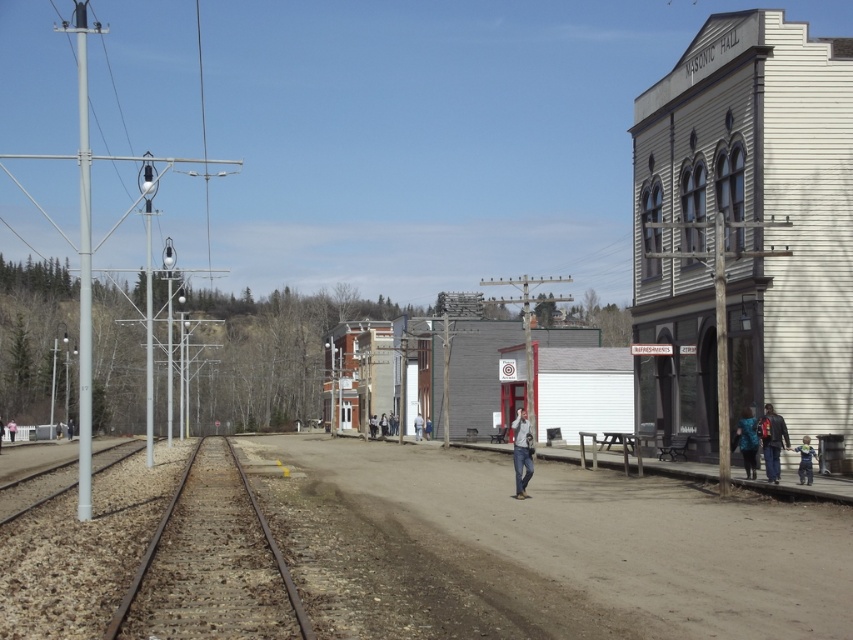
Question: Is the position of denim jeans at center less distant than that of light pink fabric at center?

Choices:
 (A) yes
 (B) no

Answer: (A)

Question: Considering the relative positions of brown dirt track at center and blue textured coat at lower right in the image provided, where is brown dirt track at center located with respect to blue textured coat at lower right?

Choices:
 (A) left
 (B) right

Answer: (A)

Question: Is white cotton shirt at center to the right of light pink fabric at center from the viewer's perspective?

Choices:
 (A) yes
 (B) no

Answer: (A)

Question: Which point is farther to the camera?

Choices:
 (A) (444, 609)
 (B) (10, 429)

Answer: (B)

Question: Which is farther from the white cotton shirt at center?

Choices:
 (A) dark blue jacket at lower right
 (B) brown dirt track at center
 (C) denim jeans at center
 (D) brown gravel train track at center

Answer: (A)

Question: Which point is farther from the camera taking this photo?

Choices:
 (A) (799, 454)
 (B) (647, 477)
 (C) (785, 444)
 (D) (15, 426)

Answer: (D)